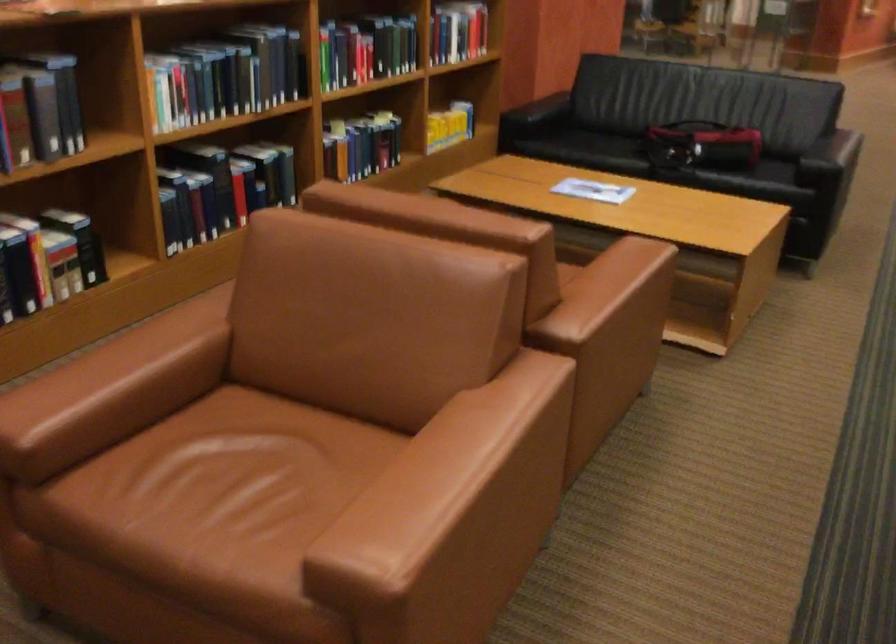
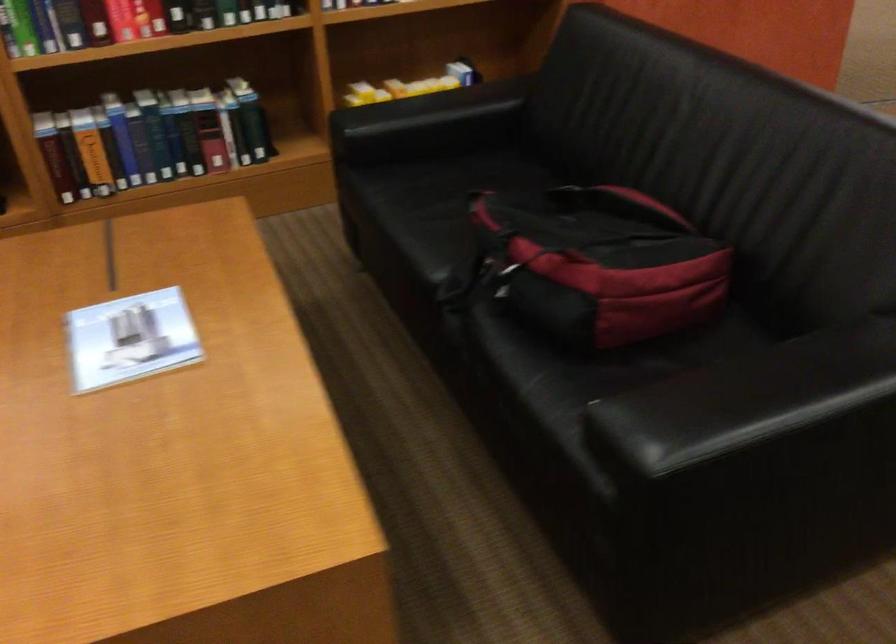
Where in the second image is the point corresponding to the point at 675,151 from the first image?

(495, 269)